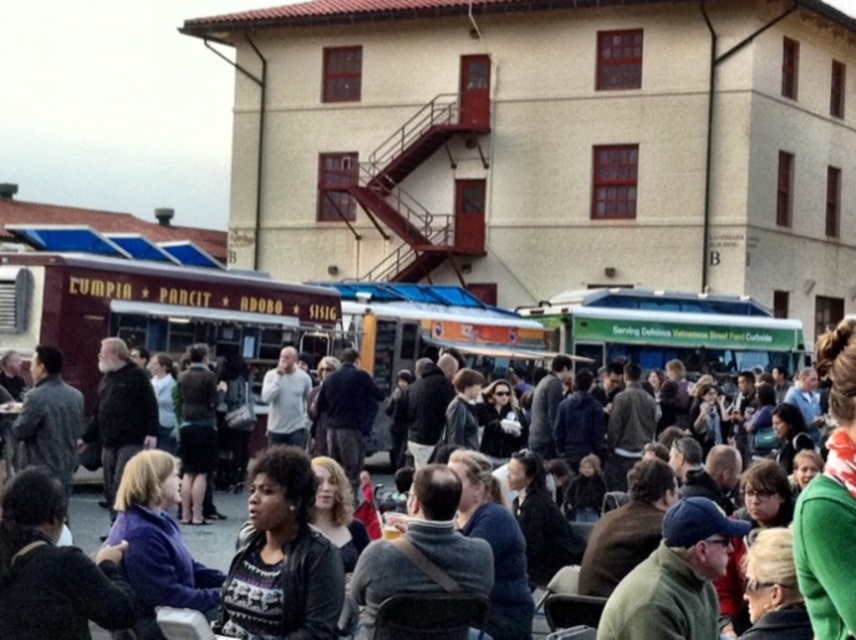
Question: Which point is closer to the camera?

Choices:
 (A) (260, 296)
 (B) (232, 513)

Answer: (B)

Question: From the image, what is the correct spatial relationship of matte red food truck at center in relation to dark gray jacket at center?

Choices:
 (A) above
 (B) below

Answer: (A)

Question: Which of the following is the closest to the observer?

Choices:
 (A) dark gray jacket at center
 (B) matte red food truck at center

Answer: (A)

Question: Is matte red food truck at center positioned before dark gray jacket at center?

Choices:
 (A) yes
 (B) no

Answer: (B)

Question: Observing the image, what is the correct spatial positioning of matte red food truck at center in reference to dark gray jacket at center?

Choices:
 (A) left
 (B) right

Answer: (A)

Question: Which of the following is the closest to the observer?

Choices:
 (A) (229, 508)
 (B) (203, 337)

Answer: (A)